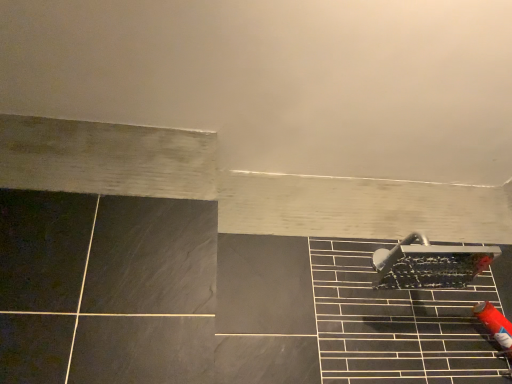
Question: Is satin nickel showerhead at lower right with matte black tile at lower right?

Choices:
 (A) yes
 (B) no

Answer: (B)

Question: Does satin nickel showerhead at lower right appear on the left side of matte black tile at lower right?

Choices:
 (A) yes
 (B) no

Answer: (B)

Question: Can you confirm if satin nickel showerhead at lower right is positioned to the right of matte black tile at lower right?

Choices:
 (A) no
 (B) yes

Answer: (B)

Question: Can you confirm if satin nickel showerhead at lower right is wider than matte black tile at lower right?

Choices:
 (A) no
 (B) yes

Answer: (A)

Question: From a real-world perspective, is satin nickel showerhead at lower right physically below matte black tile at lower right?

Choices:
 (A) yes
 (B) no

Answer: (B)

Question: Is matte black tile at lower right located within satin nickel showerhead at lower right?

Choices:
 (A) no
 (B) yes

Answer: (A)

Question: Does matte black tile at lower right lie in front of satin nickel showerhead at lower right?

Choices:
 (A) yes
 (B) no

Answer: (A)

Question: From a real-world perspective, does matte black tile at lower right sit lower than satin nickel showerhead at lower right?

Choices:
 (A) no
 (B) yes

Answer: (B)

Question: Considering the relative sizes of matte black tile at lower right and satin nickel showerhead at lower right in the image provided, is matte black tile at lower right taller than satin nickel showerhead at lower right?

Choices:
 (A) yes
 (B) no

Answer: (A)

Question: From the image's perspective, would you say matte black tile at lower right is positioned over satin nickel showerhead at lower right?

Choices:
 (A) no
 (B) yes

Answer: (A)

Question: Is matte black tile at lower right next to satin nickel showerhead at lower right?

Choices:
 (A) no
 (B) yes

Answer: (A)

Question: Can you confirm if matte black tile at lower right is thinner than satin nickel showerhead at lower right?

Choices:
 (A) no
 (B) yes

Answer: (A)

Question: Is point (349, 269) closer or farther from the camera than point (372, 258)?

Choices:
 (A) farther
 (B) closer

Answer: (B)